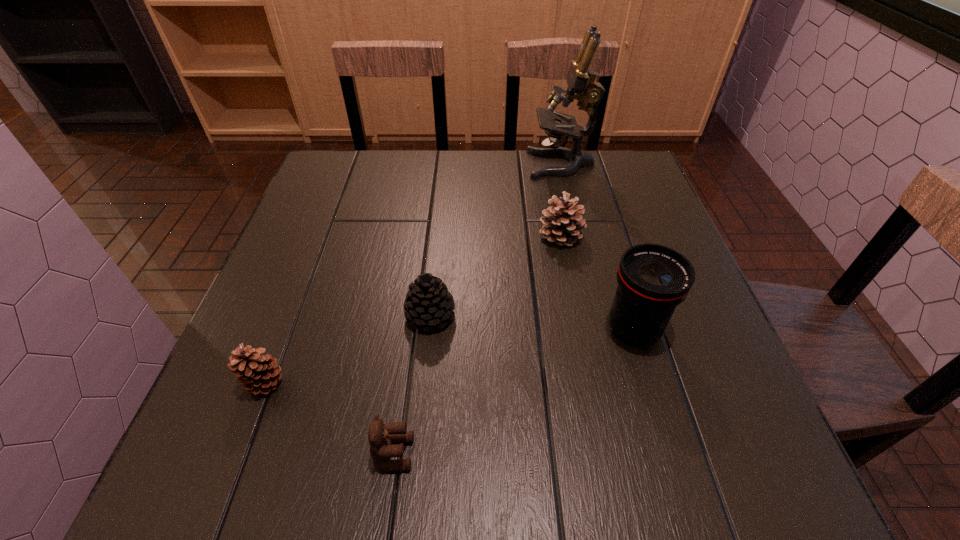
Find the location of a particular element. The image size is (960, 540). microscope present at the right edge is located at coordinates (580, 79).

Identify the location of telephoto lens that is positioned at the right edge. (653, 279).

This screenshot has width=960, height=540. Find the location of `object present at the far right corner`. object present at the far right corner is located at coordinates (580, 79).

In the image, there is a desktop. Identify the location of free space at the far edge. This screenshot has height=540, width=960. (535, 187).

This screenshot has width=960, height=540. What are the coordinates of `vacant area at the near edge of the desktop` in the screenshot? It's located at (516, 442).

Identify the location of vacant space at the left edge of the desktop. This screenshot has width=960, height=540. (322, 221).

Where is `vacant point at the right edge`? The image size is (960, 540). vacant point at the right edge is located at coordinates (696, 385).

In the image, there is a desktop. Identify the location of vacant space at the far left corner. click(316, 195).

At what (x,y) coordinates should I click in order to perform the action: click on vacant space that is in between the second farthest pinecone and the fifth nearest object. Please return your answer as a coordinate pair (x, y). The image size is (960, 540). Looking at the image, I should click on (495, 275).

Where is `empty space that is in between the second pinecone from right to left and the farthest object`? The height and width of the screenshot is (540, 960). empty space that is in between the second pinecone from right to left and the farthest object is located at coordinates (495, 240).